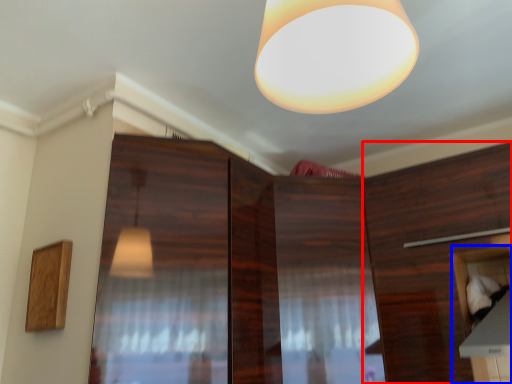
Question: Which of the following is the closest to the observer, cabinetry (highlighted by a red box) or cabinetry (highlighted by a blue box)?

Choices:
 (A) cabinetry
 (B) cabinetry

Answer: (B)